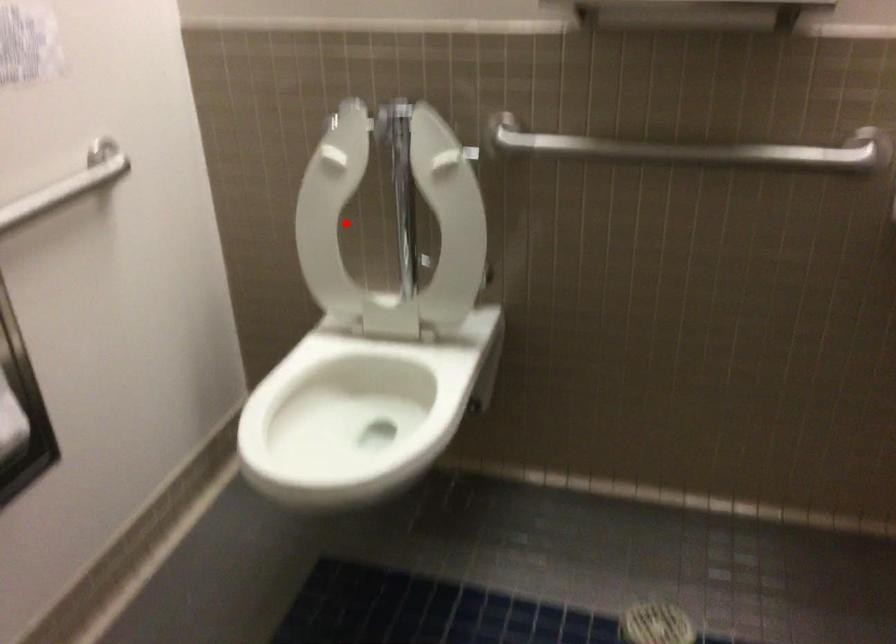
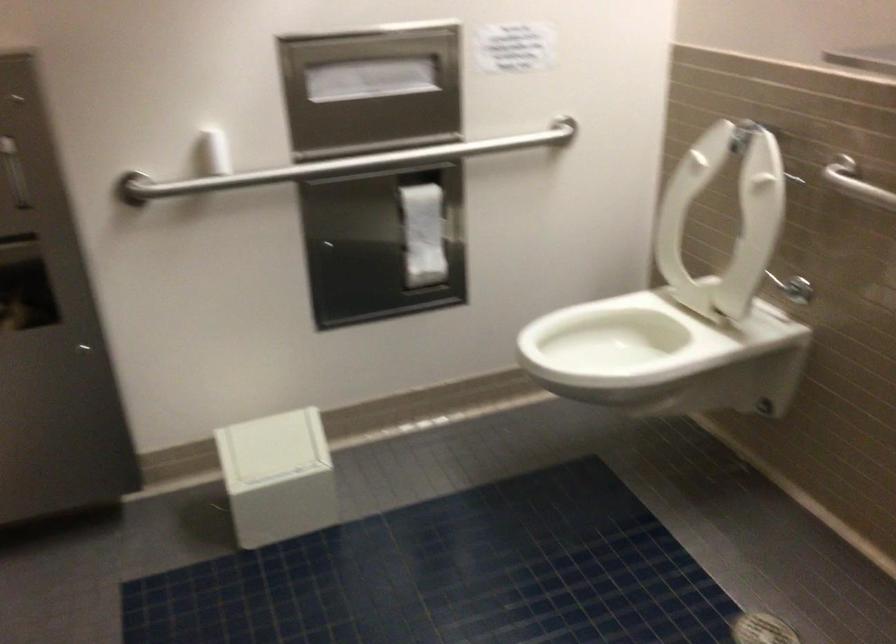
Locate, in the second image, the point that corresponds to the highlighted location in the first image.

(724, 219)